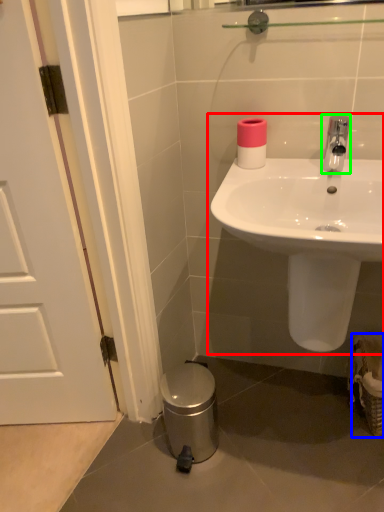
Question: Based on their relative distances, which object is farther from sink (highlighted by a red box)? Choose from basket (highlighted by a blue box) and tap (highlighted by a green box).

Choices:
 (A) basket
 (B) tap

Answer: (A)